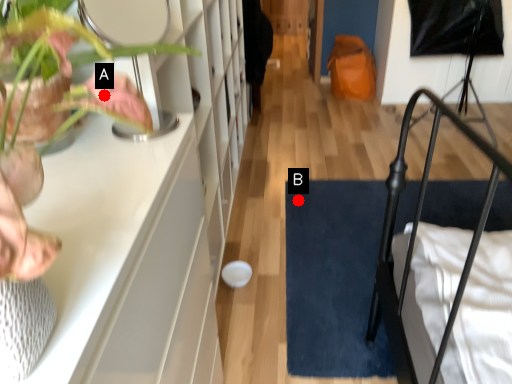
Question: Two points are circled on the image, labeled by A and B beside each circle. Which point is farther from the camera taking this photo?

Choices:
 (A) A is further
 (B) B is further

Answer: (B)